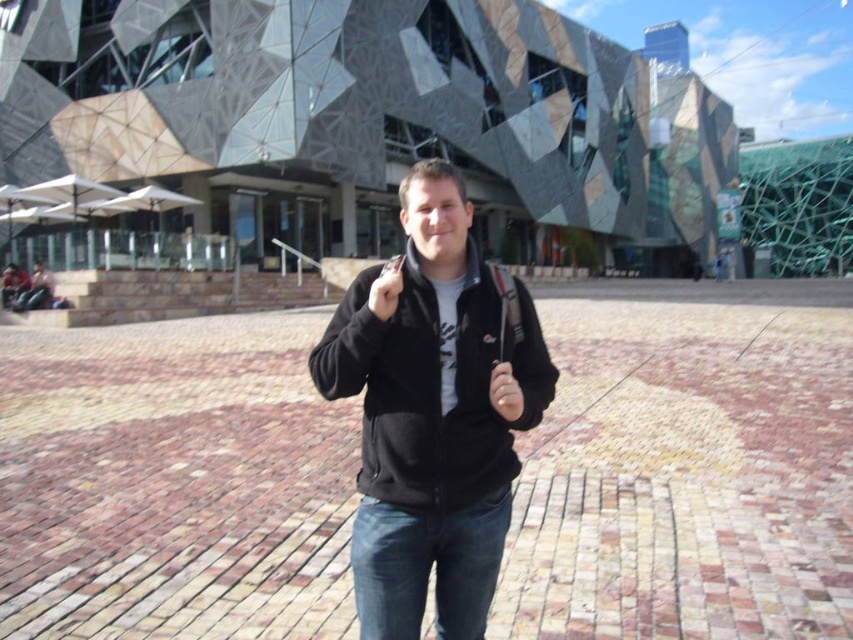
Is point (752, 340) in front of point (392, 294)?

No, it is not.

Which is in front, point (315, 628) or point (390, 289)?

Point (390, 289) is more forward.

Identify the location of brick pavement at center. (x=688, y=467).

Based on the photo, is black fleece jacket at center closer to camera compared to matte black hand at center?

Yes, black fleece jacket at center is closer to the viewer.

Does black fleece jacket at center have a lesser width compared to matte black hand at center?

No, black fleece jacket at center is not thinner than matte black hand at center.

Which is in front, point (368, 326) or point (498, 381)?

Positioned in front is point (498, 381).

Locate an element on the screen. This screenshot has width=853, height=640. black fleece jacket at center is located at coordinates (432, 417).

Who is positioned more to the left, denim at center or matte black phone at center?

matte black phone at center is more to the left.

What do you see at coordinates (427, 566) in the screenshot? I see `denim at center` at bounding box center [427, 566].

Describe the element at coordinates (427, 566) in the screenshot. I see `denim at center` at that location.

Locate an element on the screen. Image resolution: width=853 pixels, height=640 pixels. denim at center is located at coordinates (427, 566).